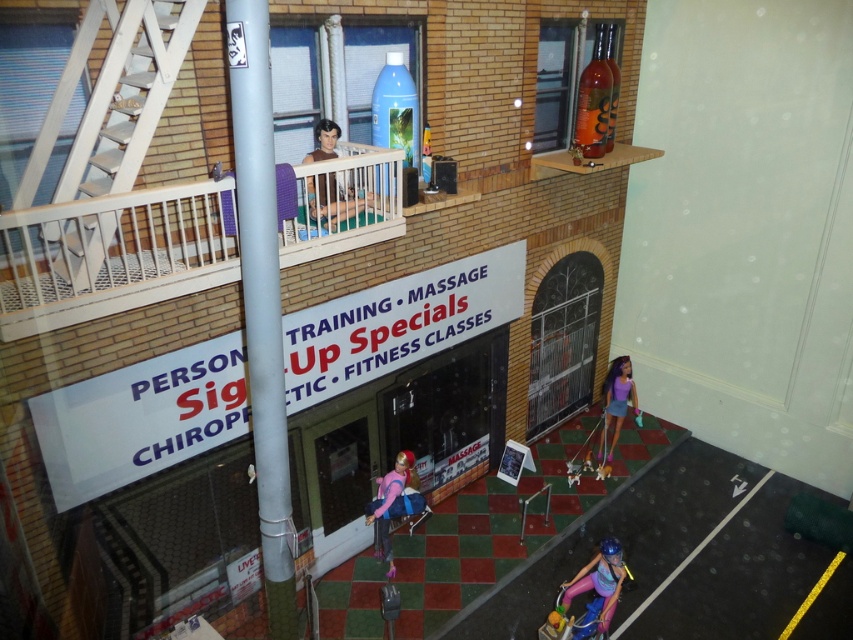
Question: Among these objects, which one is farthest from the camera?

Choices:
 (A) smooth brown doll at upper center
 (B) white wooden railing at upper center

Answer: (A)

Question: Which of the following is the farthest from the observer?

Choices:
 (A) (259, 12)
 (B) (611, 548)

Answer: (B)

Question: Does white wooden railing at upper center have a lesser width compared to purple fabric doll at lower right?

Choices:
 (A) no
 (B) yes

Answer: (A)

Question: Can you confirm if white wooden railing at upper center is smaller than matte pink helmet at lower center?

Choices:
 (A) no
 (B) yes

Answer: (A)

Question: Can you confirm if metallic gray pole at center is thinner than purple fabric doll at lower right?

Choices:
 (A) no
 (B) yes

Answer: (B)

Question: Among these points, which one is farthest from the camera?

Choices:
 (A) (235, 244)
 (B) (366, 513)
 (C) (595, 589)
 (D) (241, 81)

Answer: (B)